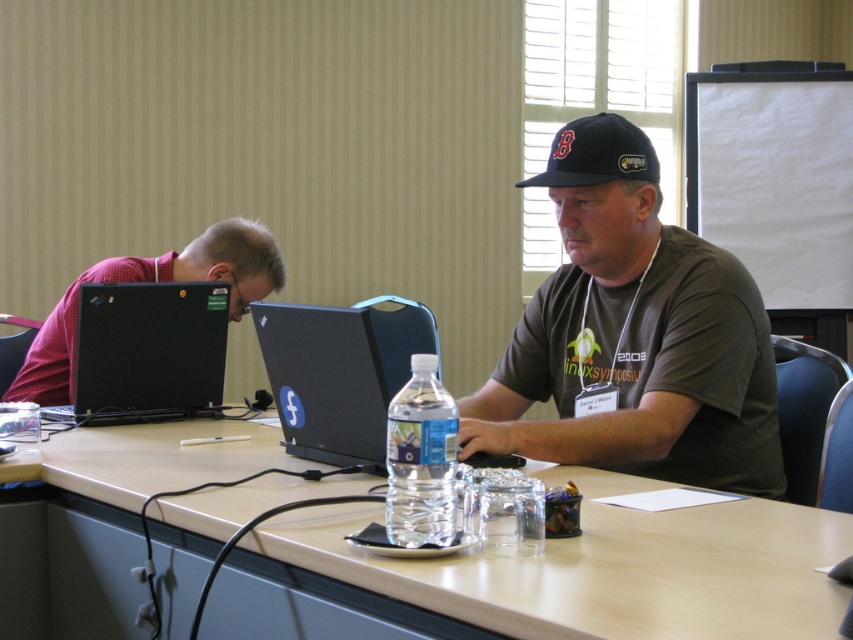
Is point (267, 308) in front of point (67, 332)?

Yes, point (267, 308) is closer to viewer.

Consider the image. Is black plastic laptop at center positioned in front of matte black laptop at left?

No, black plastic laptop at center is behind matte black laptop at left.

Locate an element on the screen. The width and height of the screenshot is (853, 640). black plastic laptop at center is located at coordinates (339, 372).

Which is above, black plastic laptop at center or black matte laptop at left?

black plastic laptop at center is higher up.

Can you confirm if black plastic laptop at center is positioned below black matte laptop at left?

No.

Image resolution: width=853 pixels, height=640 pixels. I want to click on black plastic laptop at center, so click(x=339, y=372).

Is black matte laptop at left to the left of matte black laptop at left from the viewer's perspective?

No, black matte laptop at left is not to the left of matte black laptop at left.

Does black matte laptop at left have a larger size compared to matte black laptop at left?

No.

At what (x,y) coordinates should I click in order to perform the action: click on black matte laptop at left. Please return your answer as a coordinate pair (x, y). Looking at the image, I should click on (148, 353).